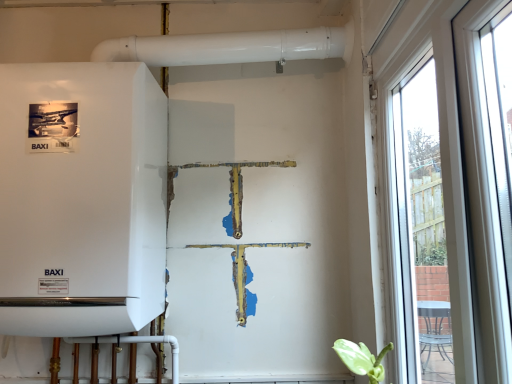
Measure the distance between point (456, 330) and camera.

Point (456, 330) is 30.67 inches from camera.

This screenshot has width=512, height=384. In order to click on transparent glass window at right in this screenshot , I will do `click(453, 168)`.

This screenshot has width=512, height=384. What do you see at coordinates (453, 168) in the screenshot? I see `transparent glass window at right` at bounding box center [453, 168].

Find the location of a particular element. white matte boiler at left is located at coordinates (82, 200).

Image resolution: width=512 pixels, height=384 pixels. Describe the element at coordinates (82, 200) in the screenshot. I see `white matte boiler at left` at that location.

Where is `transparent glass window at right`? transparent glass window at right is located at coordinates (453, 168).

Is white matte boiler at left at the right side of transparent glass window at right?

In fact, white matte boiler at left is to the left of transparent glass window at right.

Which object is closer to the camera taking this photo, white matte boiler at left or transparent glass window at right?

transparent glass window at right is more forward.

Is point (158, 135) positioned behind point (471, 167)?

Yes, point (158, 135) is behind point (471, 167).

From the image's perspective, is white matte boiler at left positioned above or below transparent glass window at right?

white matte boiler at left is above transparent glass window at right.

From a real-world perspective, which is physically above, white matte boiler at left or transparent glass window at right?

From a 3D spatial view, white matte boiler at left is above.

Looking at their sizes, would you say white matte boiler at left is wider or thinner than transparent glass window at right?

In the image, white matte boiler at left appears to be wider than transparent glass window at right.

Is white matte boiler at left shorter than transparent glass window at right?

Yes.

From the picture: Considering the relative sizes of white matte boiler at left and transparent glass window at right in the image provided, is white matte boiler at left bigger than transparent glass window at right?

Yes, white matte boiler at left is bigger than transparent glass window at right.

Is white matte boiler at left located outside transparent glass window at right?

Yes, white matte boiler at left is outside of transparent glass window at right.

Is white matte boiler at left next to transparent glass window at right?

No, white matte boiler at left is not in contact with transparent glass window at right.

Is white matte boiler at left oriented towards transparent glass window at right?

No.

How many degrees apart are the facing directions of white matte boiler at left and transparent glass window at right?

There is a 87.3-degree angle between the facing directions of white matte boiler at left and transparent glass window at right.

How distant is white matte boiler at left from transparent glass window at right?

white matte boiler at left is 83.74 centimeters from transparent glass window at right.

Locate an element on the screen. This screenshot has height=384, width=512. appliance behind the transparent glass window at right is located at coordinates (82, 200).

Considering the relative positions of transparent glass window at right and white matte boiler at left in the image provided, is transparent glass window at right to the left of white matte boiler at left from the viewer's perspective?

Incorrect, transparent glass window at right is not on the left side of white matte boiler at left.

In the scene shown: Is transparent glass window at right in front of or behind white matte boiler at left in the image?

Visually, transparent glass window at right is located in front of white matte boiler at left.

Does point (410, 314) appear closer or farther from the camera than point (92, 286)?

Point (410, 314) is farther from the camera than point (92, 286).

From the image's perspective, is transparent glass window at right on top of white matte boiler at left?

Actually, transparent glass window at right appears below white matte boiler at left in the image.

From a real-world perspective, which is physically below, transparent glass window at right or white matte boiler at left?

In real-world perspective, transparent glass window at right is lower.

Between transparent glass window at right and white matte boiler at left, which one has larger width?

Wider between the two is white matte boiler at left.

Is transparent glass window at right shorter than white matte boiler at left?

No.

Is transparent glass window at right bigger than white matte boiler at left?

No.

Is transparent glass window at right spatially inside white matte boiler at left, or outside of it?

transparent glass window at right is spatially situated outside white matte boiler at left.

Can you see transparent glass window at right touching white matte boiler at left?

They are not placed beside each other.

Could you tell me if transparent glass window at right is turned towards white matte boiler at left?

Yes, transparent glass window at right faces towards white matte boiler at left.

Where is `window below the white matte boiler at left (from the image's perspective)`? window below the white matte boiler at left (from the image's perspective) is located at coordinates (453, 168).

In order to click on appliance lying on the left of transparent glass window at right in this screenshot , I will do `click(82, 200)`.

Where is `appliance above the transparent glass window at right (from a real-world perspective)`? The height and width of the screenshot is (384, 512). appliance above the transparent glass window at right (from a real-world perspective) is located at coordinates (82, 200).